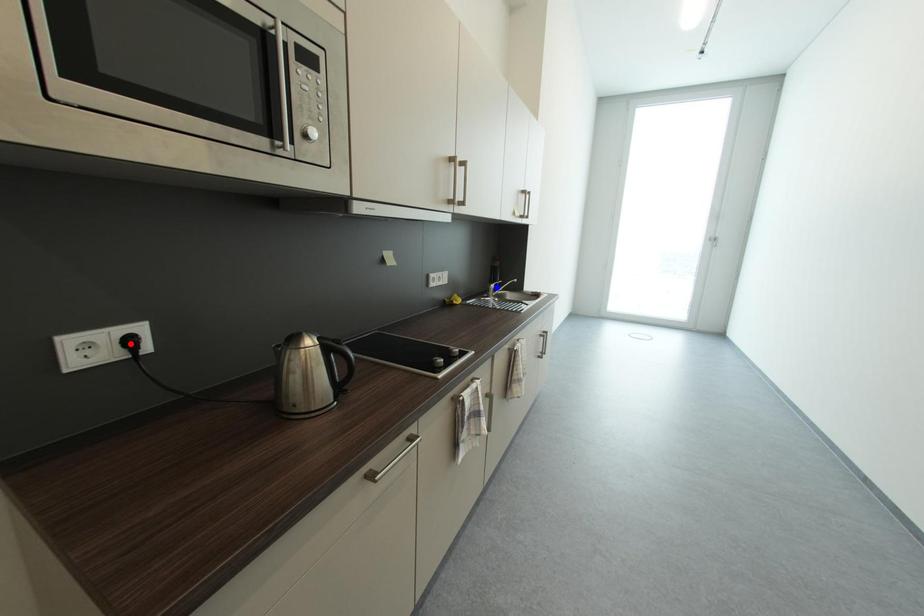
Question: Which of the two points in the image is closer to the camera?

Choices:
 (A) Blue point is closer.
 (B) Red point is closer.

Answer: (B)